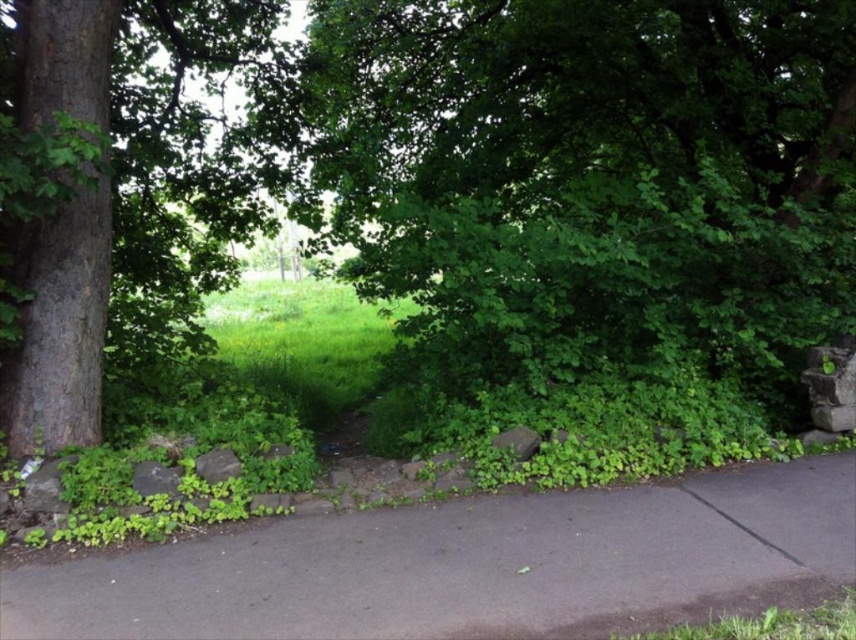
Question: Observing the image, what is the correct spatial positioning of smooth brown tree trunk at left in reference to green leafy grass at lower right?

Choices:
 (A) below
 (B) above

Answer: (B)

Question: Which object is the farthest from the gray asphalt pavement at center?

Choices:
 (A) smooth brown tree trunk at left
 (B) green leafy tree at center
 (C) green leafy grass at lower right

Answer: (A)

Question: Can you confirm if green leafy tree at center is bigger than green leafy grass at lower right?

Choices:
 (A) no
 (B) yes

Answer: (B)

Question: Does smooth brown tree trunk at left appear under green leafy grass at lower right?

Choices:
 (A) no
 (B) yes

Answer: (A)

Question: Which of the following is the farthest from the observer?

Choices:
 (A) (75, 212)
 (B) (259, 161)
 (C) (829, 632)
 (D) (201, 550)

Answer: (B)

Question: Estimate the real-world distances between objects in this image. Which object is farther from the green leafy tree at center?

Choices:
 (A) smooth brown tree trunk at left
 (B) green leafy grass at lower right
 (C) gray asphalt pavement at center

Answer: (A)